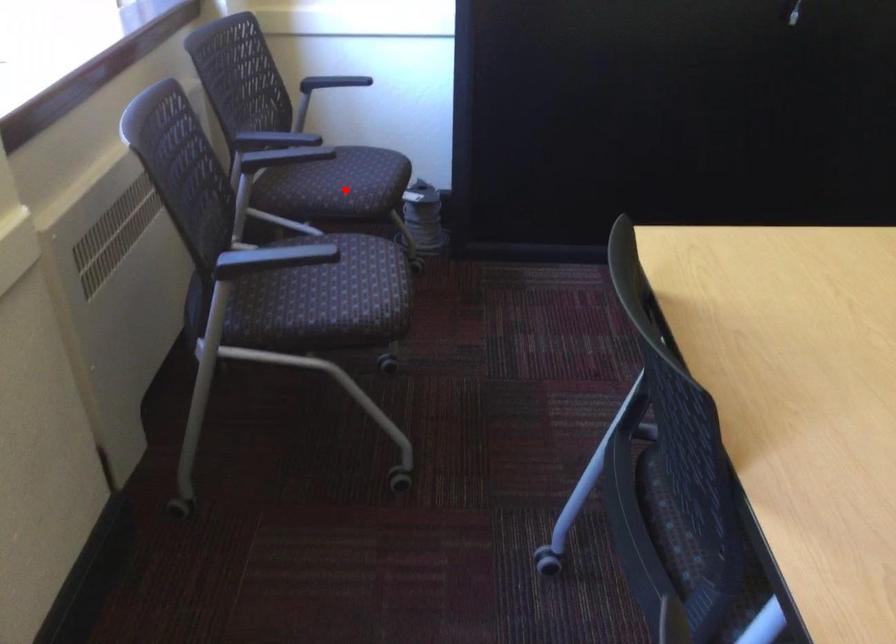
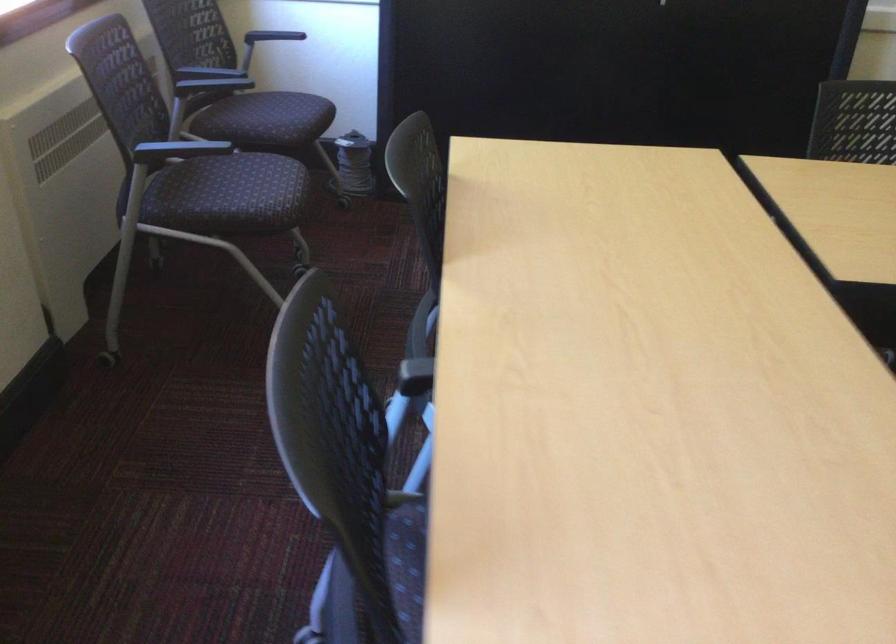
Locate, in the second image, the point that corresponds to the highlighted location in the first image.

(271, 120)